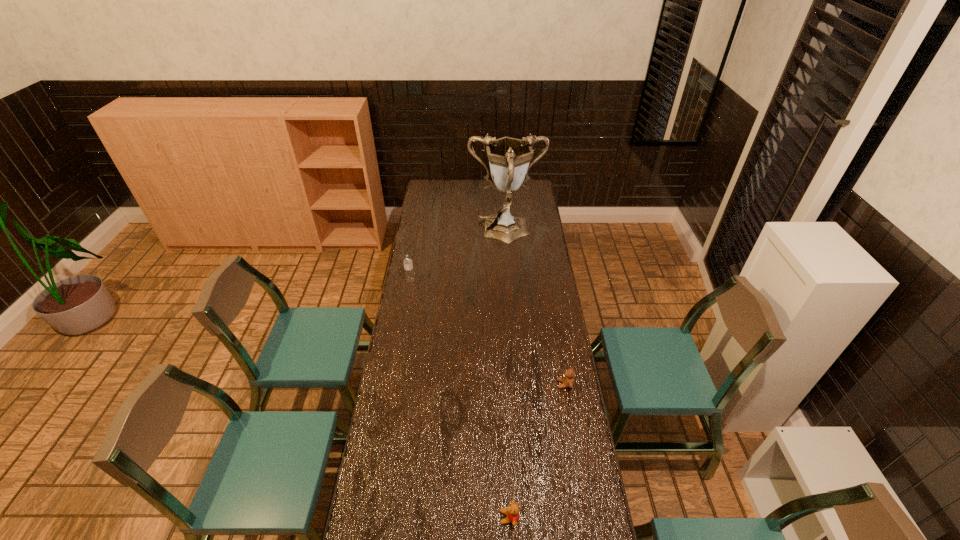
At what (x,y) coordinates should I click in order to perform the action: click on free space located 0.100m on the face of the right teddy bear. Please return your answer as a coordinate pair (x, y). The image size is (960, 540). Looking at the image, I should click on (532, 384).

I want to click on vacant region located 0.080m on the face of the right teddy bear, so click(537, 384).

The height and width of the screenshot is (540, 960). What are the coordinates of `free location located 0.240m on the face of the right teddy bear` in the screenshot? It's located at (497, 384).

Where is `vacant area situated on the front-facing side of the left teddy bear`? The width and height of the screenshot is (960, 540). vacant area situated on the front-facing side of the left teddy bear is located at coordinates (427, 517).

I want to click on vacant region located 0.220m on the front-facing side of the left teddy bear, so click(430, 517).

Where is `vacant space located 0.120m on the front-facing side of the left teddy bear`? vacant space located 0.120m on the front-facing side of the left teddy bear is located at coordinates (462, 517).

Find the location of a particular element. The height and width of the screenshot is (540, 960). object that is at the left edge is located at coordinates (408, 265).

The image size is (960, 540). What are the coordinates of `trophy cup located at the right edge` in the screenshot? It's located at (510, 159).

Find the location of a particular element. Image resolution: width=960 pixels, height=540 pixels. teddy bear located at the right edge is located at coordinates (568, 381).

Where is `vacant area at the far edge of the desktop`? vacant area at the far edge of the desktop is located at coordinates (485, 181).